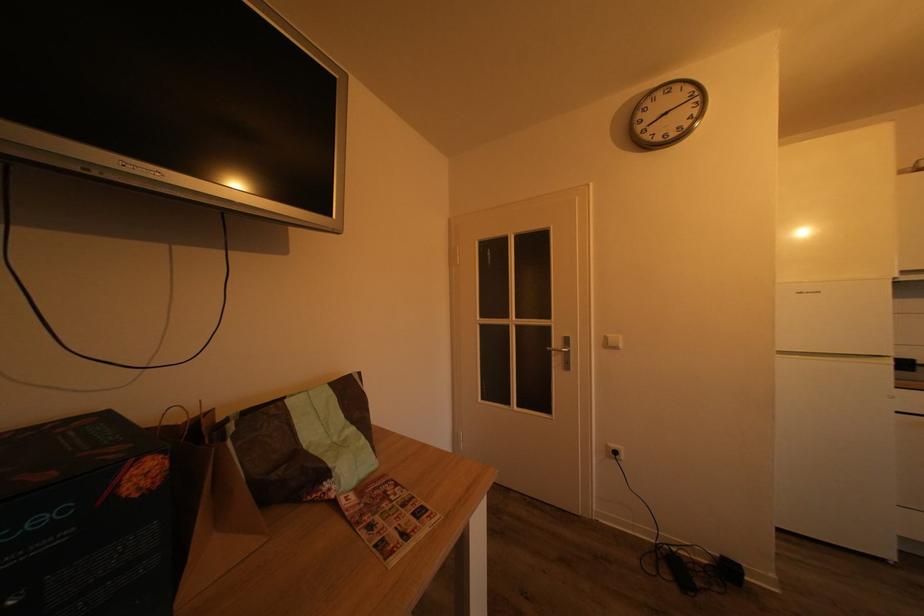
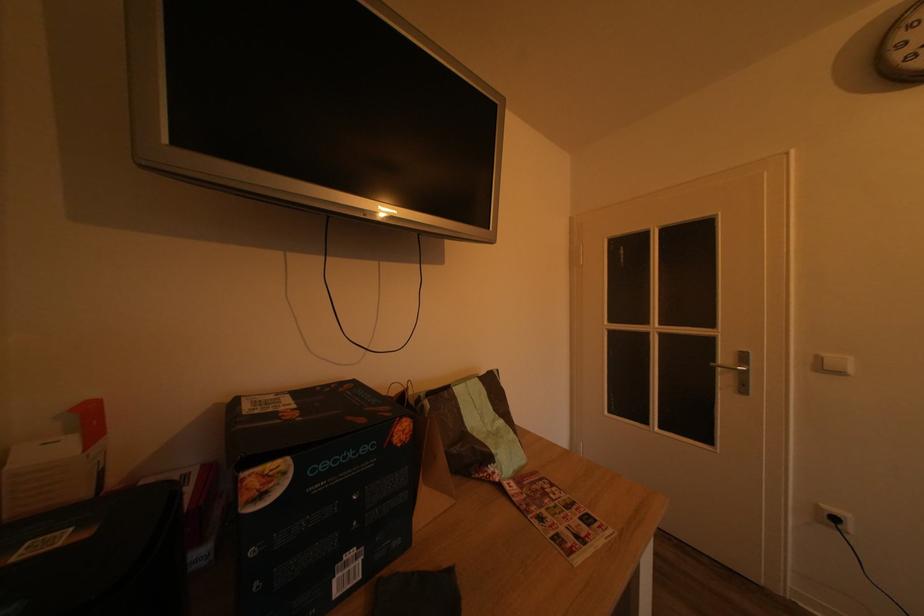
Find the pixel in the second image that matches point 558,352 in the first image.

(723, 368)